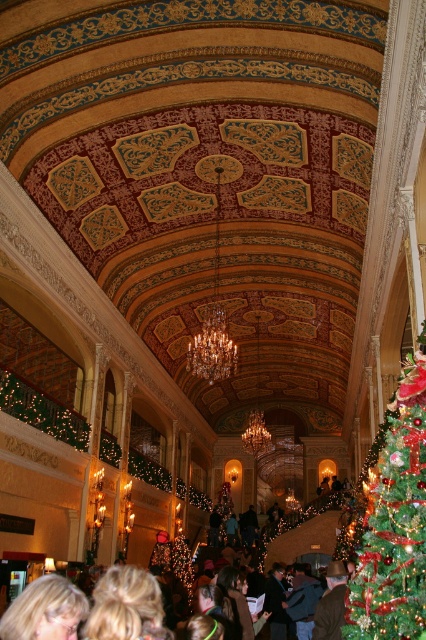
You are standing in the historic building and want to take a photo of the point at coordinates (420, 436). If your camera has a maximum zoom range of 20 meters, will you be able to capture the point clearly in your photo?

The point at coordinates (420, 436) is 21.76 meters away from the camera. Since the camera can only zoom up to 20 meters, it won not be able to capture the point clearly.

You are standing in the historic building and want to place your brown leather jacket on a coat rack located to the left of the green shiny christmas tree at center. Is the brown leather jacket at center currently positioned where you need it to be?

The green shiny christmas tree at center is to the right of the brown leather jacket at center, so the brown leather jacket at center is already positioned to the left of the tree, which matches the desired location for the coat rack. Therefore, the brown leather jacket at center is already where you need it to be.